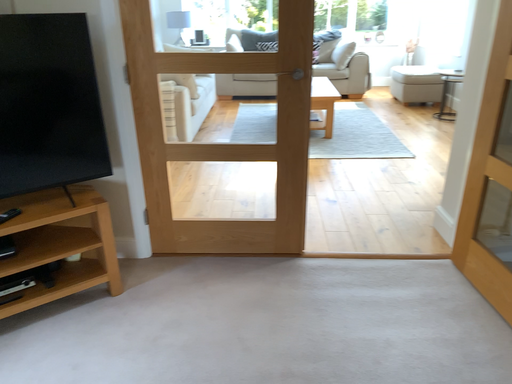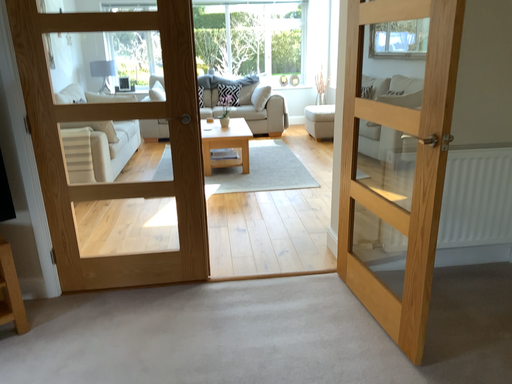
Question: How did the camera likely rotate when shooting the video?

Choices:
 (A) rotated left
 (B) rotated right

Answer: (B)